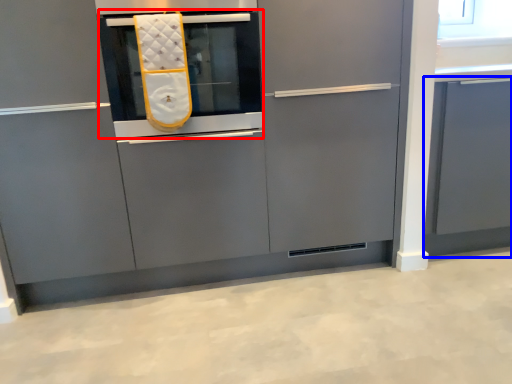
Question: Among these objects, which one is nearest to the camera, oven (highlighted by a red box) or cabinetry (highlighted by a blue box)?

Choices:
 (A) oven
 (B) cabinetry

Answer: (A)